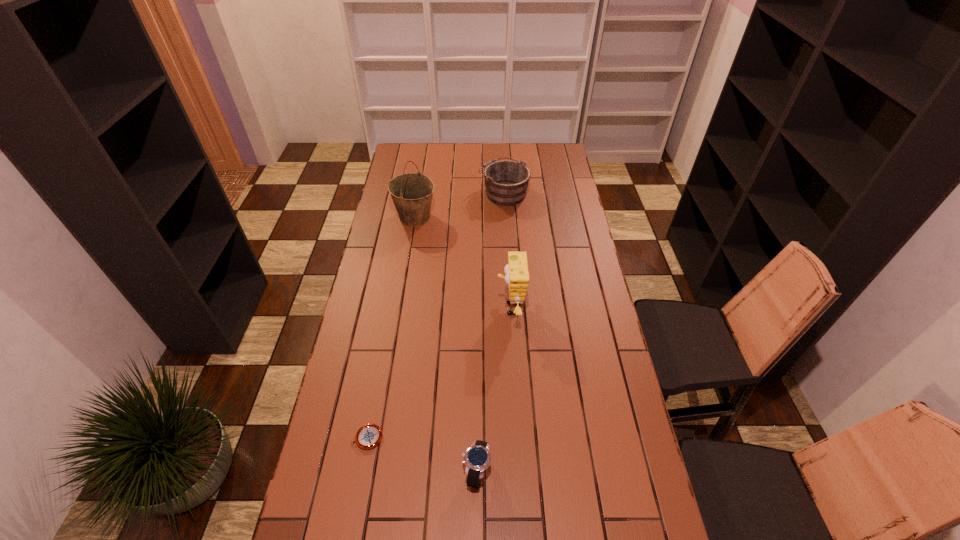
At what (x,y) coordinates should I click in order to perform the action: click on vacant point at the far left corner. Please return your answer as a coordinate pair (x, y). Looking at the image, I should click on click(420, 145).

Where is `vacant space at the far right corner of the desktop`? vacant space at the far right corner of the desktop is located at coordinates (555, 152).

The height and width of the screenshot is (540, 960). I want to click on free space between the shortest object and the taller wine bucket, so click(391, 328).

Where is `free spot between the shortest object and the watch`? The height and width of the screenshot is (540, 960). free spot between the shortest object and the watch is located at coordinates (422, 454).

Identify the location of vacant area that lies between the sponge and the watch. This screenshot has width=960, height=540. (493, 390).

You are a GUI agent. You are given a task and a screenshot of the screen. Output one action in this format:
    pyautogui.click(x=<x>, y=<y>)
    Task: Click on the free space between the tallest object and the third tallest object
    Image resolution: width=960 pixels, height=540 pixels.
    Given the screenshot: What is the action you would take?
    pyautogui.click(x=459, y=205)

Image resolution: width=960 pixels, height=540 pixels. What are the coordinates of `vacant region between the third nearest object and the right wine bucket` in the screenshot? It's located at (507, 251).

What are the coordinates of `free space between the shorter wine bucket and the second shortest object` in the screenshot? It's located at (491, 332).

Find the location of `unoccupied position between the taller wine bucket and the shortest object`. unoccupied position between the taller wine bucket and the shortest object is located at coordinates (391, 328).

Where is `free spot between the shortest object and the right wine bucket`? Image resolution: width=960 pixels, height=540 pixels. free spot between the shortest object and the right wine bucket is located at coordinates (436, 315).